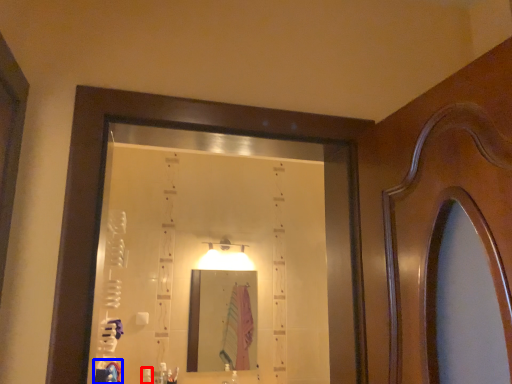
Question: Which object appears closest to the camera in this image, toiletry (highlighted by a red box) or robe (highlighted by a blue box)?

Choices:
 (A) toiletry
 (B) robe

Answer: (B)